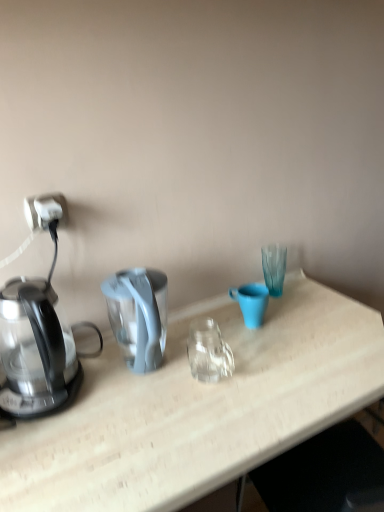
In order to click on white plastic power outlet at left in this screenshot , I will do `click(45, 211)`.

What do you see at coordinates (36, 349) in the screenshot?
I see `transparent glass kettle at left` at bounding box center [36, 349].

This screenshot has height=512, width=384. What are the coordinates of `matte blue mug at center` in the screenshot? It's located at (251, 302).

Does transparent glass kettle at left appear on the right side of white plastic power outlet at left?

No.

What's the angular difference between transparent glass kettle at left and white plastic power outlet at left's facing directions?

There is a 1.58-degree angle between the facing directions of transparent glass kettle at left and white plastic power outlet at left.

Based on the photo, is white plastic power outlet at left completely or partially inside transparent glass kettle at left?

That's incorrect, white plastic power outlet at left is not inside transparent glass kettle at left.

Is white plastic power outlet at left at the back of transparent glass kettle at left?

transparent glass kettle at left is not turned away from white plastic power outlet at left.

Considering their positions, is white plastic power outlet at left located in front of or behind transparent glass kettle at left?

Clearly, white plastic power outlet at left is behind transparent glass kettle at left.

From the image's perspective, who appears lower, white plastic power outlet at left or transparent glass kettle at left?

From the image's view, transparent glass kettle at left is below.

Is white plastic power outlet at left situated inside transparent glass kettle at left or outside?

white plastic power outlet at left is not inside transparent glass kettle at left, it's outside.

Which is more to the left, white plastic power outlet at left or transparent glass kettle at left?

From the viewer's perspective, transparent glass kettle at left appears more on the left side.

Looking at their sizes, would you say transparent glass kettle at left is wider or thinner than matte blue mug at center?

Clearly, transparent glass kettle at left has more width compared to matte blue mug at center.

Which is nearer, (x=102, y=343) or (x=245, y=301)?

Clearly, point (x=102, y=343) is closer to the camera than point (x=245, y=301).

Where is `coffee cup lying behind the transparent glass kettle at left`? The image size is (384, 512). coffee cup lying behind the transparent glass kettle at left is located at coordinates (251, 302).

Consider the image. Does matte blue mug at center turn towards transparent glass kettle at left?

No, matte blue mug at center is not aimed at transparent glass kettle at left.

The width and height of the screenshot is (384, 512). What are the coordinates of `coffee cup behind the transparent glass kettle at left` in the screenshot? It's located at (251, 302).

Consider the image. How far apart are matte blue mug at center and transparent glass kettle at left?

20.01 inches.

From the image's perspective, between matte blue mug at center and white plastic power outlet at left, who is located below?

matte blue mug at center.

Which of these two, matte blue mug at center or white plastic power outlet at left, is wider?

With larger width is matte blue mug at center.

Is point (256, 322) closer or farther from the camera than point (58, 195)?

Point (256, 322) is positioned farther from the camera compared to point (58, 195).

Is matte blue mug at center inside the boundaries of white plastic power outlet at left, or outside?

matte blue mug at center exists outside the volume of white plastic power outlet at left.

From the image's perspective, is white plastic power outlet at left beneath matte blue mug at center?

Actually, white plastic power outlet at left appears above matte blue mug at center in the image.

At what (x,y) coordinates should I click in order to perform the action: click on coffee cup on the right of white plastic power outlet at left. Please return your answer as a coordinate pair (x, y). The height and width of the screenshot is (512, 384). Looking at the image, I should click on pos(251,302).

Considering the sizes of objects white plastic power outlet at left and matte blue mug at center in the image provided, who is thinner, white plastic power outlet at left or matte blue mug at center?

white plastic power outlet at left is thinner.

What's the angular difference between white plastic power outlet at left and matte blue mug at center's facing directions?

They differ by 1.58 degrees in their facing directions.

You are a GUI agent. You are given a task and a screenshot of the screen. Output one action in this format:
    pyautogui.click(x=<x>, y=<y>)
    Task: Click on the kettle lying below the white plastic power outlet at left (from the image's perspective)
    The image size is (384, 512).
    Given the screenshot: What is the action you would take?
    pyautogui.click(x=36, y=349)

Identify the location of power outlet on the right of transparent glass kettle at left. The height and width of the screenshot is (512, 384). (45, 211).

Based on the photo, from the image, which object appears to be nearer to white plastic power outlet at left, matte blue mug at center or transparent glass kettle at left?

The object closer to white plastic power outlet at left is transparent glass kettle at left.

Estimate the real-world distances between objects in this image. Which object is further from transparent glass kettle at left, matte blue mug at center or white plastic power outlet at left?

Based on the image, matte blue mug at center appears to be further to transparent glass kettle at left.

Estimate the real-world distances between objects in this image. Which object is further from white plastic power outlet at left, transparent glass kettle at left or matte blue mug at center?

matte blue mug at center.

Looking at the image, which one is located closer to transparent glass kettle at left, white plastic power outlet at left or matte blue mug at center?

white plastic power outlet at left is closer to transparent glass kettle at left.

Estimate the real-world distances between objects in this image. Which object is closer to matte blue mug at center, white plastic power outlet at left or transparent glass kettle at left?

Among the two, transparent glass kettle at left is located nearer to matte blue mug at center.

Estimate the real-world distances between objects in this image. Which object is further from matte blue mug at center, transparent glass kettle at left or white plastic power outlet at left?

Based on the image, white plastic power outlet at left appears to be further to matte blue mug at center.

Locate an element on the screen. The image size is (384, 512). power outlet located between transparent glass kettle at left and matte blue mug at center in the left-right direction is located at coordinates (45, 211).